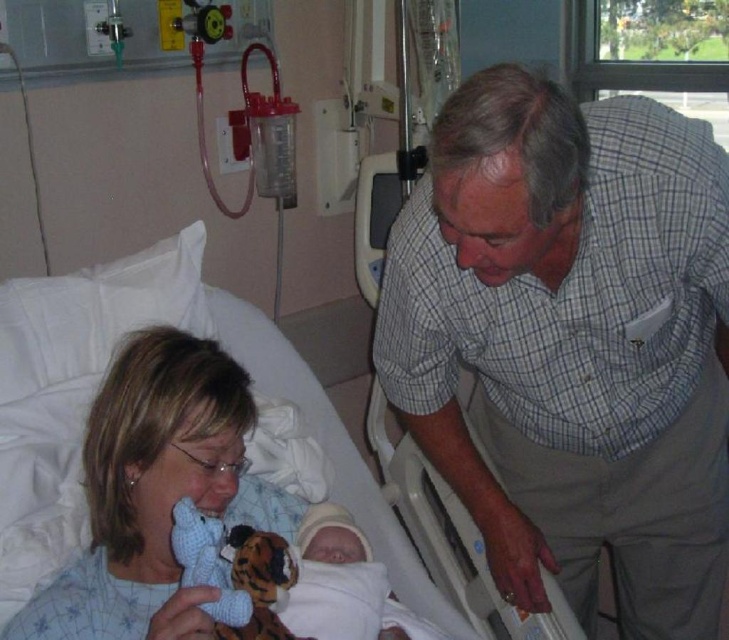
You are a nurse entering the hospital room and need to retrieve the knitted blue bear at lower left to give to the patient. However, the soft white blanket at center is blocking your path. Can you move the blanket to access the bear?

The soft white blanket at center is located below the knitted blue bear at lower left, so you can move the blanket upwards to access the bear.

You are a nurse in a hospital room. You need to place a medical kit between the blue fabric at left and the knitted blue bear at lower left. The medical kit is 5 inches long. Can you fit it between them?

The blue fabric at left is 4.94 inches from the knitted blue bear at lower left. Since the medical kit is 5 inches long, it cannot fit between them as the distance is slightly less than the required space.